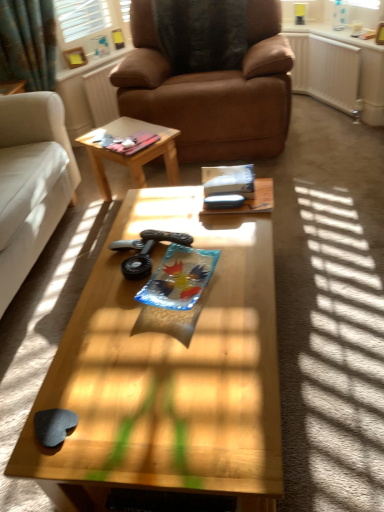
You are a GUI agent. You are given a task and a screenshot of the screen. Output one action in this format:
    pyautogui.click(x=<x>, y=<y>)
    Task: Click on the vacant area on the back side of black plastic game controller at center
    
    Given the screenshot: What is the action you would take?
    pyautogui.click(x=153, y=227)